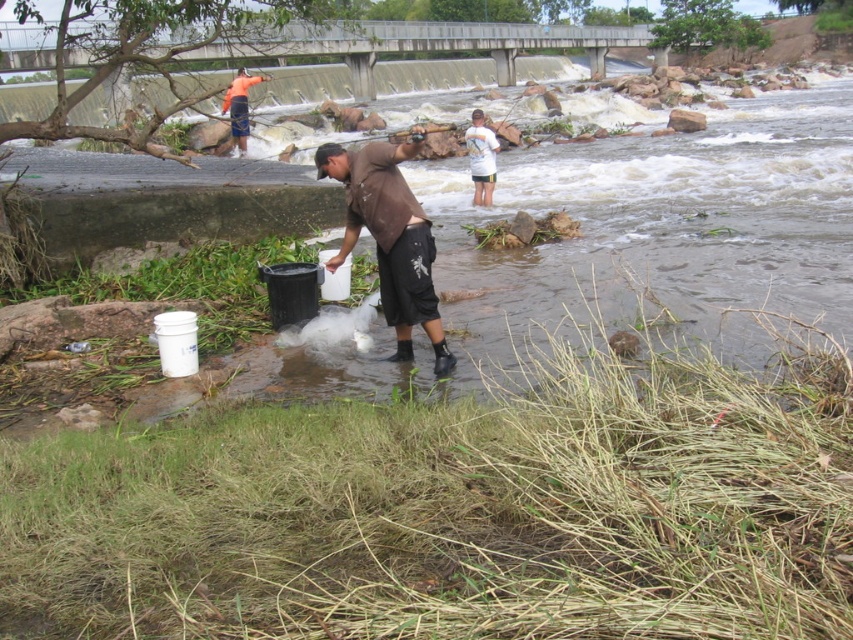
You are a photographer trying to capture both the brown matte shirt at center and the orange fabric shirt at upper left in a single frame. Which person should you focus on first to ensure both are in focus?

You should focus on the brown matte shirt at center first since it is closer to the viewer than the orange fabric shirt at upper left, ensuring both are in focus when using depth of field properly.

You are standing at the point labeled point (474, 193) and want to walk to point (235, 102). Which direction should you move in to get closer to your destination?

You should move away from the camera because point (474, 193) is closer to the camera than point (235, 102). Moving away from the camera would bring you closer to point (235, 102).

You are a photographer trying to capture the person in the brown matte shirt at center and the person in the white cotton shirt at upper center. Which of the two shirts is closer to the camera?

The brown matte shirt at center is positioned under the white cotton shirt at upper center, meaning the white cotton shirt at upper center is closer to the camera.